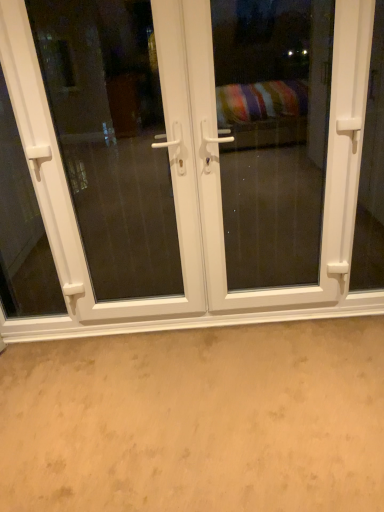
The width and height of the screenshot is (384, 512). What do you see at coordinates (22, 230) in the screenshot?
I see `white plastic handle at left` at bounding box center [22, 230].

What do you see at coordinates (272, 136) in the screenshot? I see `white plastic screen door at center, arranged as the second screen door when viewed from the left` at bounding box center [272, 136].

Where is `white plastic door at center`? white plastic door at center is located at coordinates pos(193,184).

Relative to white plastic door at center, is white plastic handle at left in front or behind?

Visually, white plastic handle at left is located behind white plastic door at center.

I want to click on door in front of the white plastic handle at left, so click(x=193, y=184).

Based on their sizes in the image, would you say white plastic handle at left is bigger or smaller than white plastic door at center?

Considering their sizes, white plastic handle at left takes up less space than white plastic door at center.

Is white plastic handle at left positioned with its back to white plastic door at center?

Yes, white plastic handle at left is facing away from white plastic door at center.

Between white plastic door at center and white plastic handle at left, which one has larger size?

Bigger between the two is white plastic door at center.

Which of these two, white plastic door at center or white plastic handle at left, stands taller?

With more height is white plastic door at center.

Between point (45, 227) and point (21, 164), which one is positioned behind?

Positioned behind is point (21, 164).

Between white plastic screen door at center, which appears as the first screen door when viewed from the right, and beige carpet at lower center, which one is positioned behind?

Positioned behind is white plastic screen door at center, which appears as the first screen door when viewed from the right.

Who is taller, white plastic screen door at center, arranged as the second screen door when viewed from the left, or beige carpet at lower center?

With more height is white plastic screen door at center, arranged as the second screen door when viewed from the left.

Looking at this image, how many degrees apart are the facing directions of white plastic door at center and white plastic screen door at center, acting as the first screen door starting from the left?

white plastic door at center and white plastic screen door at center, acting as the first screen door starting from the left, are facing 0.27 degrees away from each other.

From the picture: From a real-world perspective, between white plastic door at center and white plastic screen door at center, positioned as the 2th screen door in right-to-left order, who is vertically lower?

From a 3D spatial view, white plastic door at center is below.

Who is smaller, white plastic door at center or white plastic screen door at center, acting as the first screen door starting from the left?

white plastic screen door at center, acting as the first screen door starting from the left.

Is white plastic screen door at center, acting as the first screen door starting from the left, oriented away from beige carpet at lower center?

white plastic screen door at center, acting as the first screen door starting from the left, is not turned away from beige carpet at lower center.

What's the angular difference between white plastic screen door at center, positioned as the 2th screen door in right-to-left order, and beige carpet at lower center's facing directions?

The angular difference between white plastic screen door at center, positioned as the 2th screen door in right-to-left order, and beige carpet at lower center is 90 degrees.

Which point is more distant from viewer, (x=147, y=110) or (x=153, y=499)?

The point (x=147, y=110) is behind.

Which is correct: white plastic screen door at center, acting as the first screen door starting from the left, is inside beige carpet at lower center, or outside of it?

white plastic screen door at center, acting as the first screen door starting from the left, is not inside beige carpet at lower center, it's outside.

Considering the relative sizes of white plastic screen door at center, which appears as the first screen door when viewed from the right, and white plastic screen door at center, positioned as the 2th screen door in right-to-left order, in the image provided, is white plastic screen door at center, which appears as the first screen door when viewed from the right, wider than white plastic screen door at center, positioned as the 2th screen door in right-to-left order,?

No, white plastic screen door at center, which appears as the first screen door when viewed from the right, is not wider than white plastic screen door at center, positioned as the 2th screen door in right-to-left order.

I want to click on screen door in front of the white plastic screen door at center, arranged as the second screen door when viewed from the left, so click(x=113, y=144).

Is point (310, 242) closer to viewer compared to point (95, 85)?

Yes.

Is white plastic handle at left in front of white plastic screen door at center, which appears as the first screen door when viewed from the right?

No, it is behind white plastic screen door at center, which appears as the first screen door when viewed from the right.

Who is smaller, white plastic handle at left or white plastic screen door at center, arranged as the second screen door when viewed from the left?

Smaller between the two is white plastic handle at left.

Does white plastic handle at left have a lesser height compared to white plastic screen door at center, which appears as the first screen door when viewed from the right?

Indeed, white plastic handle at left has a lesser height compared to white plastic screen door at center, which appears as the first screen door when viewed from the right.

Locate an element on the screen. window behind the white plastic screen door at center, which appears as the first screen door when viewed from the right is located at coordinates (22, 230).

In the image, there is a white plastic handle at left. Where is `door above it (from the image's perspective)`? The image size is (384, 512). door above it (from the image's perspective) is located at coordinates (193, 184).

The width and height of the screenshot is (384, 512). What are the coordinates of `window directly beneath the white plastic door at center (from a real-world perspective)` in the screenshot? It's located at (22, 230).

Based on their spatial positions, is white plastic screen door at center, acting as the first screen door starting from the left, or white plastic door at center closer to white plastic handle at left?

The object closer to white plastic handle at left is white plastic door at center.

Based on their spatial positions, is white plastic screen door at center, which appears as the first screen door when viewed from the right, or white plastic door at center closer to white plastic screen door at center, positioned as the 2th screen door in right-to-left order?

white plastic screen door at center, which appears as the first screen door when viewed from the right, lies closer to white plastic screen door at center, positioned as the 2th screen door in right-to-left order, than the other object.

Consider the image. From the image, which object appears to be nearer to white plastic screen door at center, acting as the first screen door starting from the left, white plastic handle at left or white plastic screen door at center, which appears as the first screen door when viewed from the right?

white plastic handle at left.

Estimate the real-world distances between objects in this image. Which object is further from white plastic handle at left, white plastic screen door at center, arranged as the second screen door when viewed from the left, or white plastic screen door at center, acting as the first screen door starting from the left?

white plastic screen door at center, arranged as the second screen door when viewed from the left, is positioned further to the anchor white plastic handle at left.

Looking at the image, which one is located closer to white plastic handle at left, white plastic screen door at center, positioned as the 2th screen door in right-to-left order, or beige carpet at lower center?

Based on the image, white plastic screen door at center, positioned as the 2th screen door in right-to-left order, appears to be nearer to white plastic handle at left.

Which object lies further to the anchor point white plastic door at center, white plastic handle at left or beige carpet at lower center?

white plastic handle at left.

When comparing their distances from white plastic door at center, does white plastic handle at left or white plastic screen door at center, acting as the first screen door starting from the left, seem further?

white plastic screen door at center, acting as the first screen door starting from the left.

When comparing their distances from white plastic handle at left, does white plastic door at center or white plastic screen door at center, which appears as the first screen door when viewed from the right, seem further?

white plastic screen door at center, which appears as the first screen door when viewed from the right, is further to white plastic handle at left.

Find the location of a particular element. This screenshot has height=512, width=384. window between white plastic door at center and beige carpet at lower center in the vertical direction is located at coordinates (22, 230).

Locate an element on the screen. The width and height of the screenshot is (384, 512). door between white plastic handle at left and white plastic screen door at center, arranged as the second screen door when viewed from the left is located at coordinates (193, 184).

This screenshot has height=512, width=384. Identify the location of plain between white plastic handle at left and white plastic screen door at center, arranged as the second screen door when viewed from the left, in the horizontal direction. point(197,419).

Find the location of a particular element. door situated between white plastic screen door at center, acting as the first screen door starting from the left, and white plastic screen door at center, which appears as the first screen door when viewed from the right, from left to right is located at coordinates (193, 184).